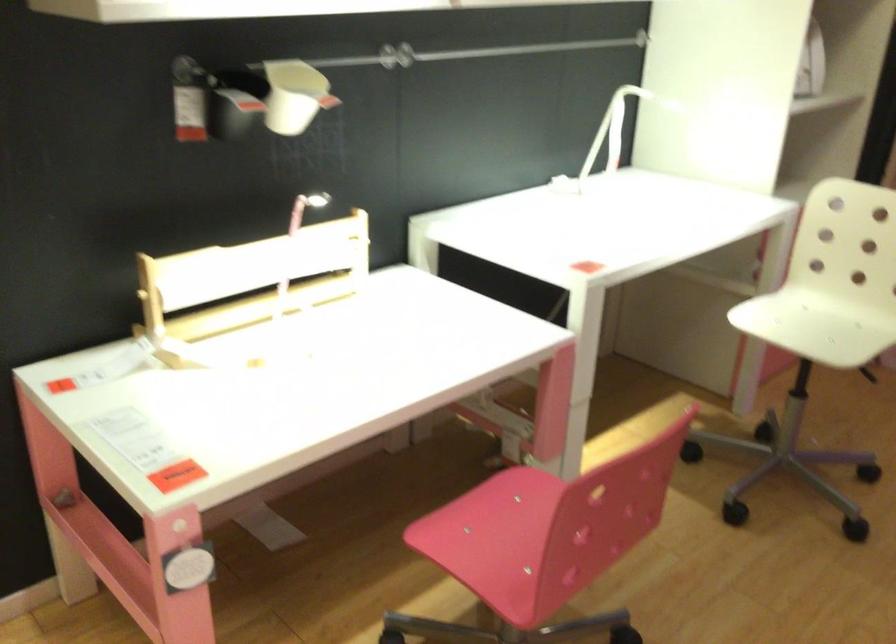
What do you see at coordinates (227, 114) in the screenshot?
I see `a black wall container` at bounding box center [227, 114].